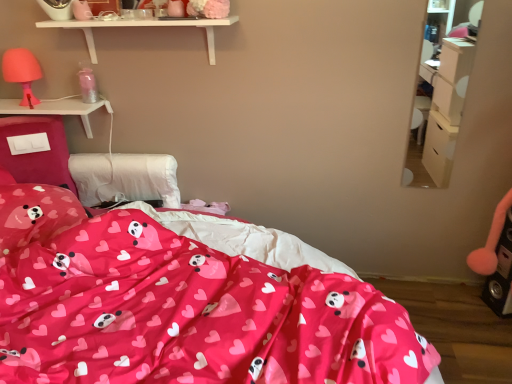
Question: Does point (22, 51) appear closer or farther from the camera than point (14, 195)?

Choices:
 (A) closer
 (B) farther

Answer: (B)

Question: In the image, is matte pink lampshade at left on the left side or the right side of matte pink pillow with heart and panda prints at lower left?

Choices:
 (A) right
 (B) left

Answer: (B)

Question: Which is nearer to the white plastic switch at left?

Choices:
 (A) white matte shelf at upper center
 (B) matte pink pillow with heart and panda prints at lower left
 (C) matte pink fabric bed at center
 (D) matte pink lampshade at left
 (E) wooden dresser at right

Answer: (D)

Question: Which of these objects is positioned farthest from the matte pink lampshade at left?

Choices:
 (A) matte pink fabric bed at center
 (B) white plastic switch at left
 (C) white matte shelf at upper center
 (D) wooden dresser at right
 (E) matte pink pillow with heart and panda prints at lower left

Answer: (D)